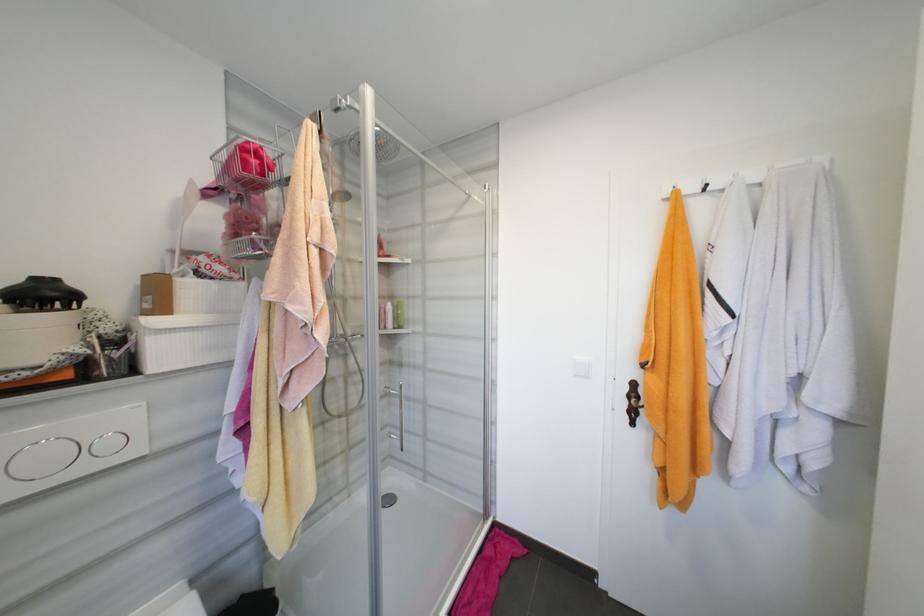
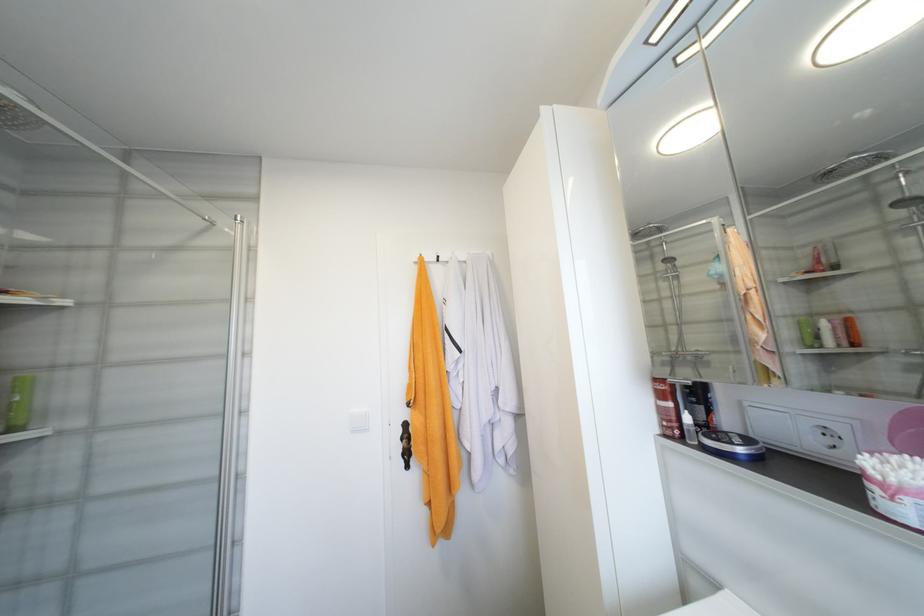
Question: The first image is from the beginning of the video and the second image is from the end. How did the camera likely rotate when shooting the video?

Choices:
 (A) Left
 (B) Right
 (C) Up
 (D) Down

Answer: (B)